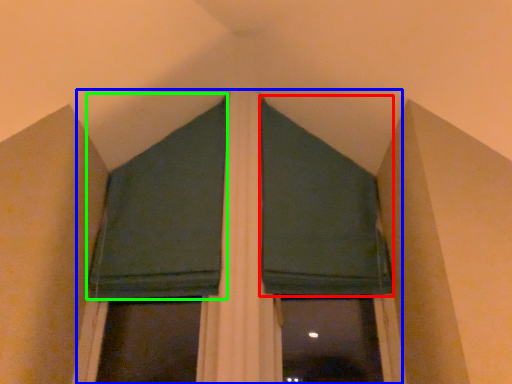
Question: Which object is positioned closest to curtain (highlighted by a red box)? Select from bay window (highlighted by a blue box) and curtain (highlighted by a green box).

Choices:
 (A) bay window
 (B) curtain

Answer: (A)